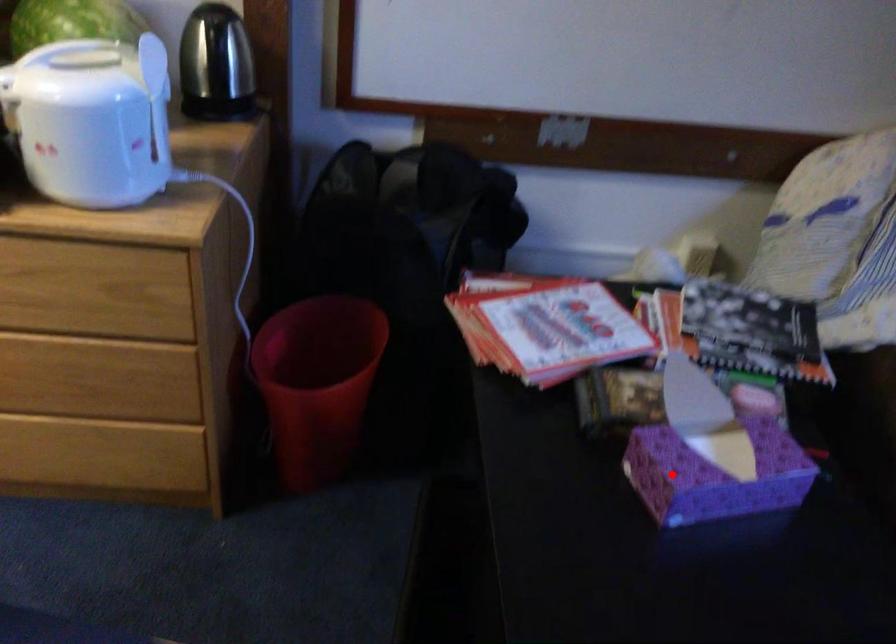
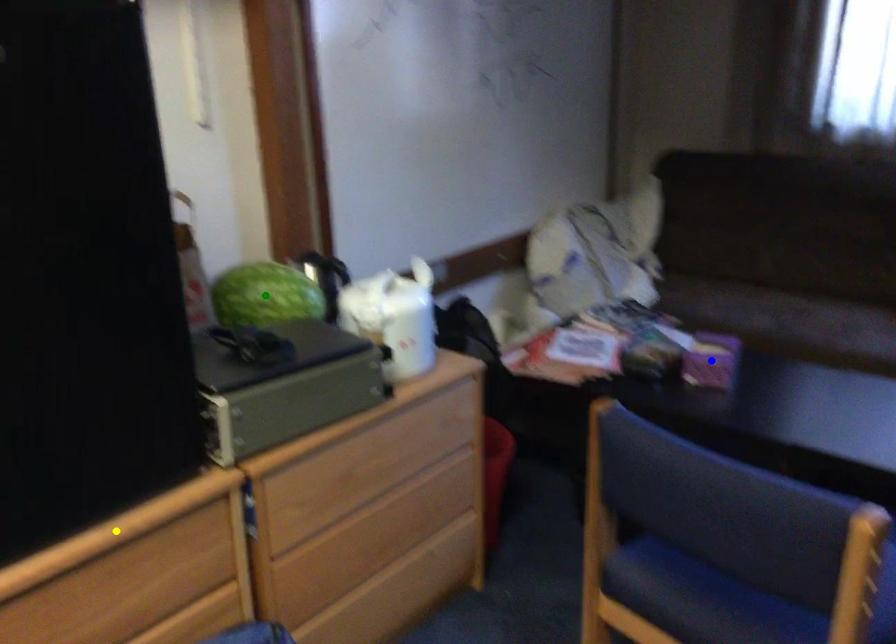
Question: I am providing you with two images of the same scene from different viewpoints. A red point is marked on the first image. You are given multiple points on the second image. Which point in image 2 represents the same 3d spot as the red point in image 1?

Choices:
 (A) yellow point
 (B) green point
 (C) blue point

Answer: (C)